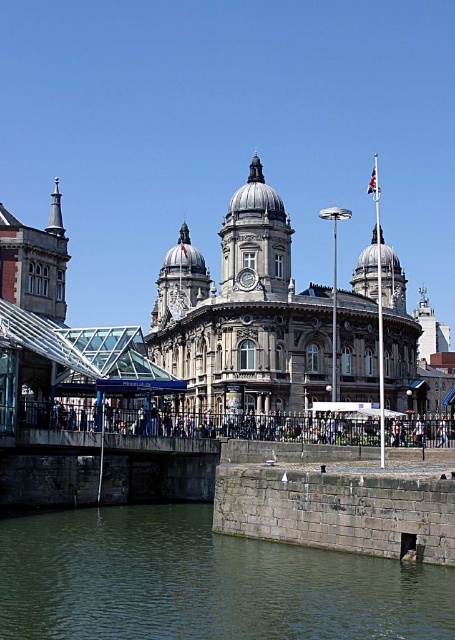
You are an architect planning to place a new sculpture between the dark gray stone bridge at center and the polished stone clock tower at center. Given their sizes, which structure should the sculpture be closer to for visual balance?

The dark gray stone bridge at center has a larger size compared to the polished stone clock tower at center. To achieve visual balance, the sculpture should be placed closer to the smaller polished stone clock tower at center to counterbalance the larger bridge.

You are a tourist standing at the edge of the greenish stone water at lower left and want to cross to the other side. Is the dark gray stone bridge at center tall enough for you to walk under without bending?

The greenish stone water at lower left is not as tall as the dark gray stone bridge at center, so the bridge is taller than the water. Since the bridge is taller, you can walk under it without bending.

You are standing at the viewpoint of the image and want to walk towards the building. Which of the two points, point (259,561) or point (171,256), is closer to you as you start walking towards the building?

Point (259,561) is closer to the viewer than point (171,256), so it will be closer as you start walking towards the building.